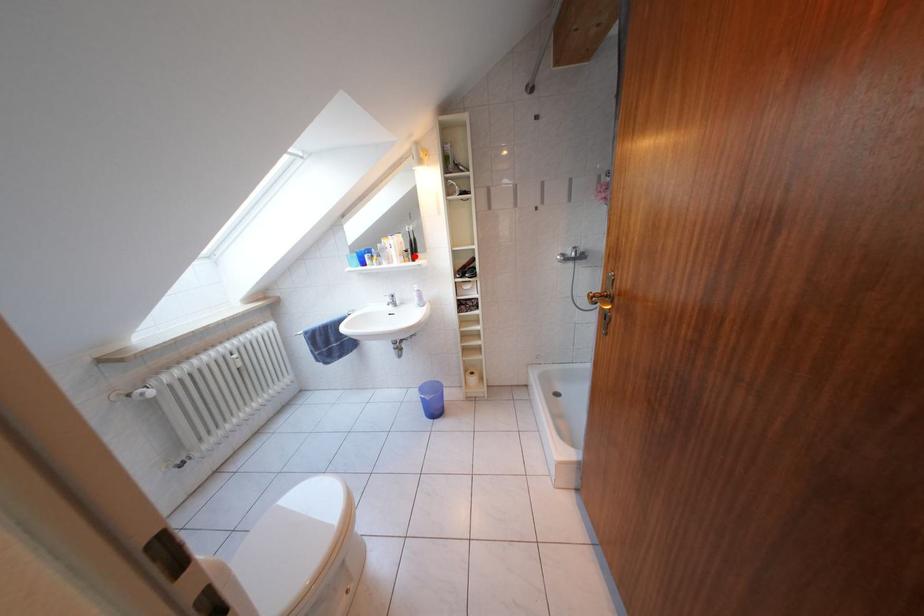
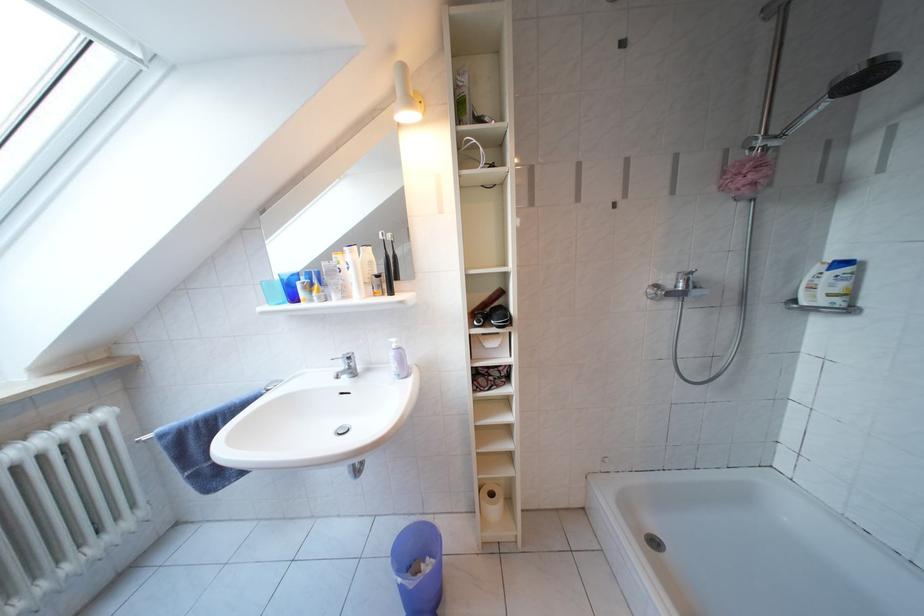
Locate, in the second image, the point that corresponds to the highlighted location in the first image.

(386, 281)